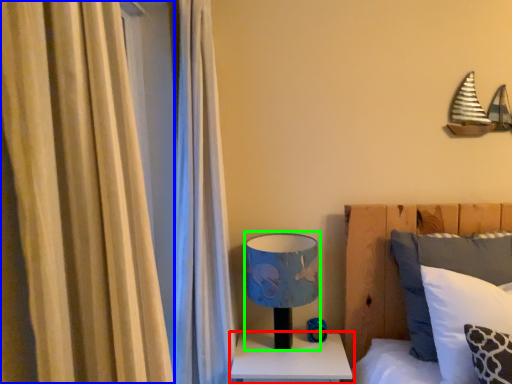
Question: Which is nearer to the nightstand (highlighted by a red box)? curtain (highlighted by a blue box) or table lamp (highlighted by a green box).

Choices:
 (A) curtain
 (B) table lamp

Answer: (B)